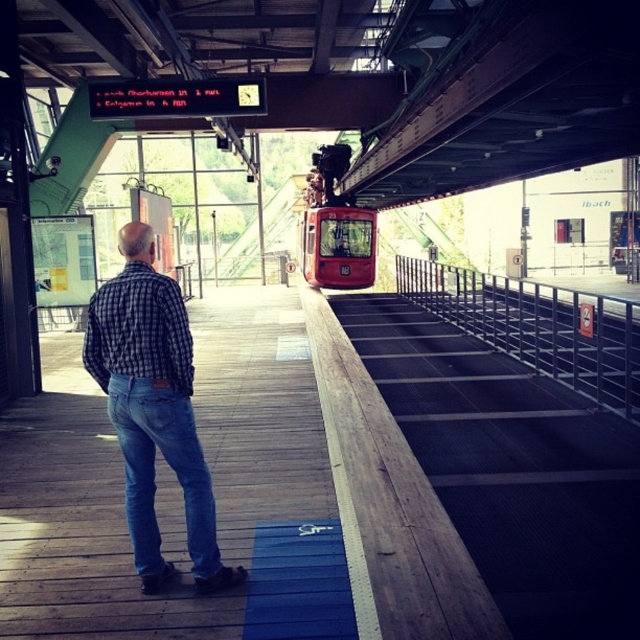
Question: Does black metal rail at right appear on the left side of blue denim jeans at lower left?

Choices:
 (A) yes
 (B) no

Answer: (B)

Question: Which object is closer to the camera taking this photo?

Choices:
 (A) shiny red train at center
 (B) black metal rail at right

Answer: (B)

Question: Can you confirm if checkered fabric shirt at center is wider than black metal rail at right?

Choices:
 (A) yes
 (B) no

Answer: (B)

Question: Among these points, which one is nearest to the camera?

Choices:
 (A) (141, 552)
 (B) (566, 356)
 (C) (340, 224)

Answer: (A)

Question: Among these objects, which one is nearest to the camera?

Choices:
 (A) black metal rail at right
 (B) checkered fabric shirt at center

Answer: (B)

Question: Can you confirm if smooth metal train track at center is positioned below checkered fabric shirt at center?

Choices:
 (A) no
 (B) yes

Answer: (B)